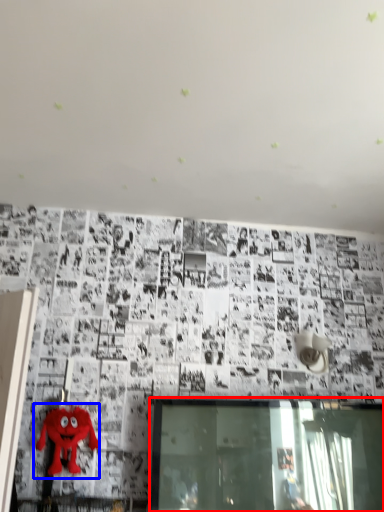
Question: Which object is closer to the camera taking this photo, window (highlighted by a red box) or toy (highlighted by a blue box)?

Choices:
 (A) window
 (B) toy

Answer: (A)